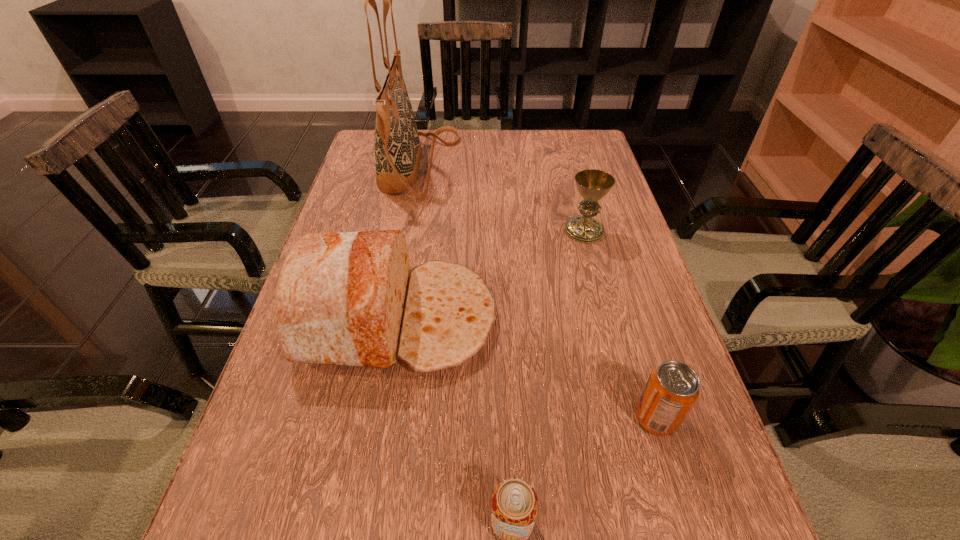
This screenshot has height=540, width=960. I want to click on free space that satisfies the following two spatial constraints: 1. at the sliced end of the soda can; 2. on the left side of the bread, so click(380, 418).